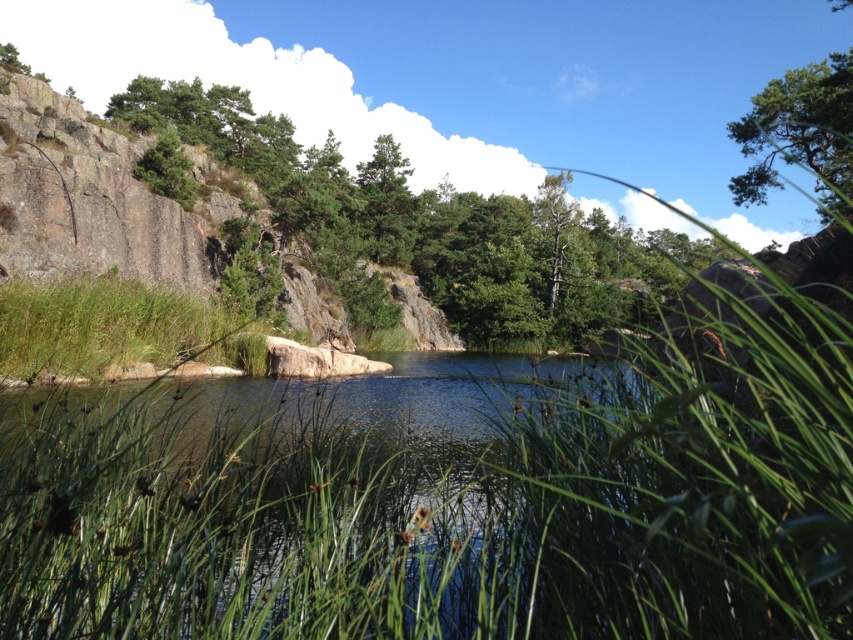
You are standing at the edge of the green grassy river at center and want to reach the green textured tree at upper right. Which direction should you walk to get closer to the tree?

You should walk upwards towards the green textured tree at upper right since it is located above the green grassy river at center.